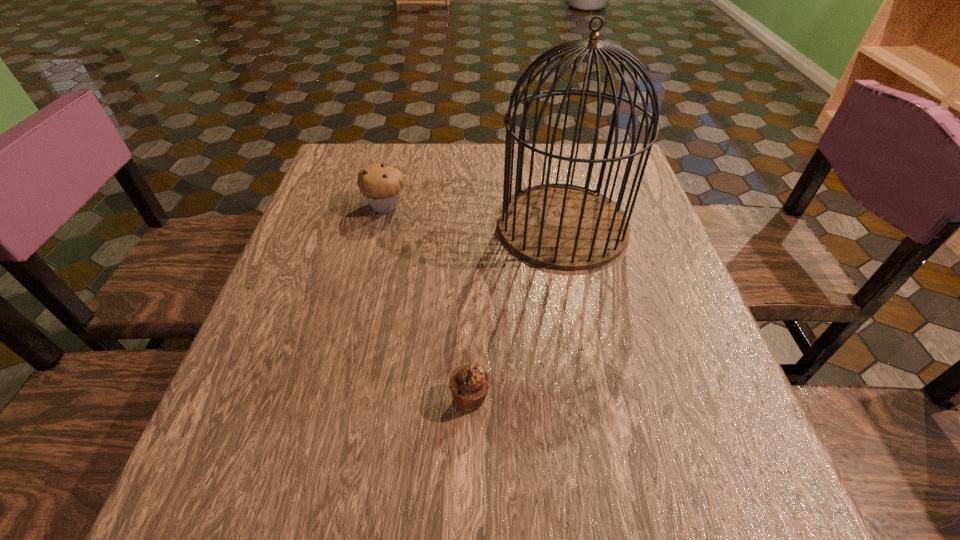
This screenshot has height=540, width=960. In order to click on free space at the near right corner in this screenshot , I will do `click(726, 509)`.

Find the location of a particular element. empty space between the right muffin and the farther muffin is located at coordinates (428, 302).

This screenshot has width=960, height=540. In order to click on free spot between the nearest object and the farther muffin in this screenshot , I will do `click(428, 302)`.

Image resolution: width=960 pixels, height=540 pixels. Find the location of `free space that is in between the farther muffin and the birdcage`. free space that is in between the farther muffin and the birdcage is located at coordinates (474, 215).

You are a GUI agent. You are given a task and a screenshot of the screen. Output one action in this format:
    pyautogui.click(x=<x>, y=<y>)
    Task: Click on the free area in between the second object from left to right and the tallest object
    This screenshot has height=540, width=960.
    Given the screenshot: What is the action you would take?
    pyautogui.click(x=516, y=312)

You are a GUI agent. You are given a task and a screenshot of the screen. Output one action in this format:
    pyautogui.click(x=<x>, y=<y>)
    Task: Click on the unoccupied position between the tallest object and the left muffin
    
    Given the screenshot: What is the action you would take?
    pyautogui.click(x=474, y=215)

Locate an element on the screen. The width and height of the screenshot is (960, 540). vacant space that is in between the nearer muffin and the leftmost object is located at coordinates (428, 302).

The height and width of the screenshot is (540, 960). I want to click on free space between the birdcage and the left muffin, so click(x=474, y=215).

Where is `vacant area that lies between the right muffin and the birdcage`? This screenshot has width=960, height=540. vacant area that lies between the right muffin and the birdcage is located at coordinates (516, 312).

What are the coordinates of `vacant space in between the leftmost object and the nearest object` in the screenshot? It's located at (428, 302).